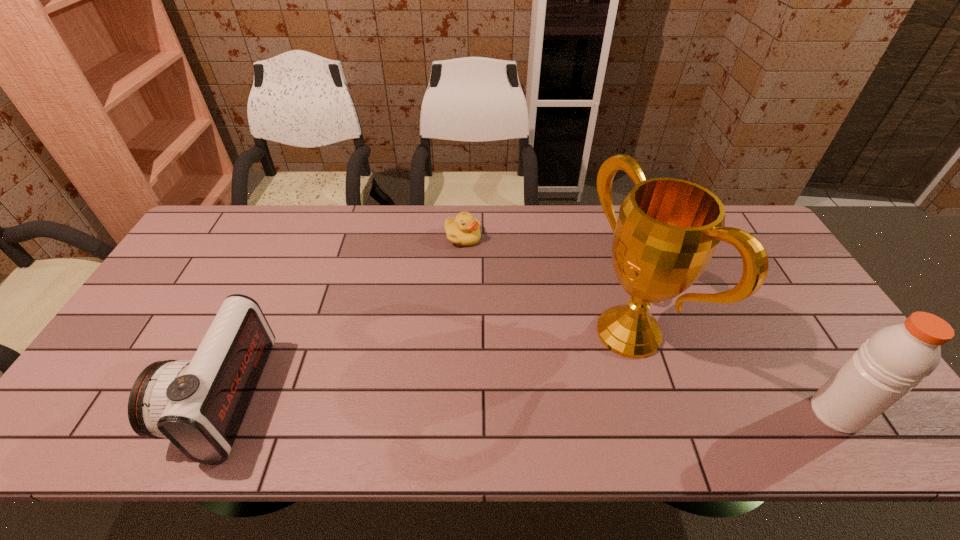
Locate an element on the screen. The image size is (960, 540). vacant space positioned 0.100m on the surface of the leftmost object is located at coordinates (148, 398).

This screenshot has height=540, width=960. What are the coordinates of `vacant area located 0.370m on the back of the shaker` in the screenshot? It's located at (756, 282).

At what (x,y) coordinates should I click in order to perform the action: click on vacant space located 0.140m on the front-facing side of the award. Please return your answer as a coordinate pair (x, y). Looking at the image, I should click on (552, 386).

Locate an element on the screen. The image size is (960, 540). vacant region located 0.230m on the front-facing side of the award is located at coordinates (520, 402).

The height and width of the screenshot is (540, 960). I want to click on vacant position located 0.130m on the front-facing side of the award, so click(x=555, y=384).

At what (x,y) coordinates should I click in order to perform the action: click on vacant space situated 0.160m on the beak of the second object from left to right. Please return your answer as a coordinate pair (x, y). This screenshot has width=960, height=540. Looking at the image, I should click on (489, 281).

The height and width of the screenshot is (540, 960). In order to click on vacant space situated on the beak of the second object from left to right in this screenshot , I will do `click(496, 294)`.

The height and width of the screenshot is (540, 960). Find the location of `vacant region located 0.150m on the beak of the second object from left to right`. vacant region located 0.150m on the beak of the second object from left to right is located at coordinates (488, 279).

Where is `object at the far edge`? Image resolution: width=960 pixels, height=540 pixels. object at the far edge is located at coordinates (464, 230).

I want to click on camcorder located in the near edge section of the desktop, so click(199, 405).